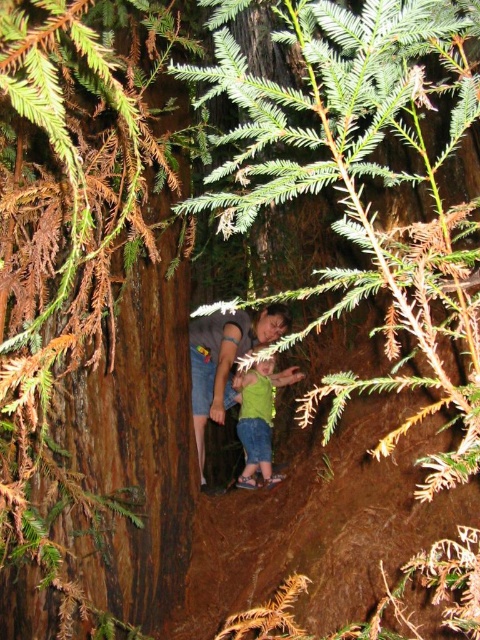
Is brown rough tree trunk at center above green matte shirt at center?

Yes, brown rough tree trunk at center is above green matte shirt at center.

Which is in front, point (158, 508) or point (265, 364)?

Positioned in front is point (158, 508).

Does point (112, 275) lie in front of point (244, 451)?

Yes, it is in front of point (244, 451).

Identify the location of brown rough tree trunk at center. (92, 310).

Is matte gray shirt at center below green matte shirt at center?

No, matte gray shirt at center is not below green matte shirt at center.

Who is higher up, matte gray shirt at center or green matte shirt at center?

matte gray shirt at center is above.

Is point (202, 412) positioned in front of point (256, 449)?

Yes, point (202, 412) is closer to viewer.

I want to click on matte gray shirt at center, so click(225, 360).

Based on the photo, how distant is brown rough tree trunk at center from matte gray shirt at center?

4.82 feet

This screenshot has width=480, height=640. Find the location of `brown rough tree trunk at center`. brown rough tree trunk at center is located at coordinates (92, 310).